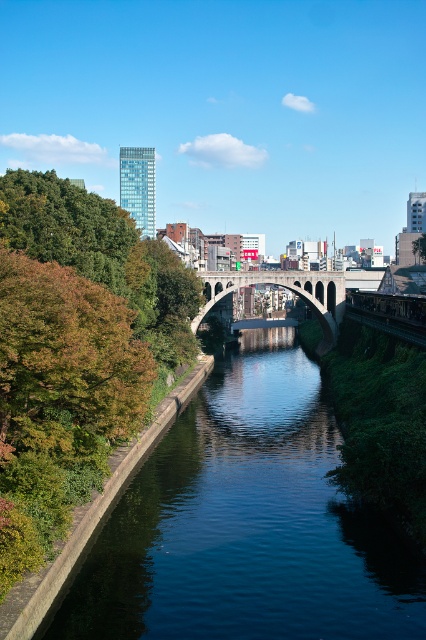
Describe the element at coordinates (74, 349) in the screenshot. This screenshot has height=640, width=426. I see `green leafy trees at left` at that location.

Is point (5, 376) closer to camera compared to point (195, 321)?

Yes, point (5, 376) is in front of point (195, 321).

Locate an element on the screen. green leafy trees at left is located at coordinates (74, 349).

Is green concrete river at center behind concrete arch bridge at center?

No, it is in front of concrete arch bridge at center.

Is green concrete river at center taller than concrete arch bridge at center?

Answer: In fact, green concrete river at center may be shorter than concrete arch bridge at center.

Does point (143, 532) come in front of point (204, 310)?

Yes, point (143, 532) is in front of point (204, 310).

At what (x,y) coordinates should I click in order to perform the action: click on green concrete river at center. Please return your answer as a coordinate pair (x, y). This screenshot has width=426, height=640. Looking at the image, I should click on pyautogui.click(x=245, y=524).

Is point (222, 435) in front of point (58, 432)?

No, (222, 435) is further to viewer.

Does point (207, 433) lie behind point (97, 275)?

That is True.

Measure the distance between green concrete river at center and camera.

green concrete river at center is 193.35 feet away from camera.

Locate an element on the screen. green concrete river at center is located at coordinates (245, 524).